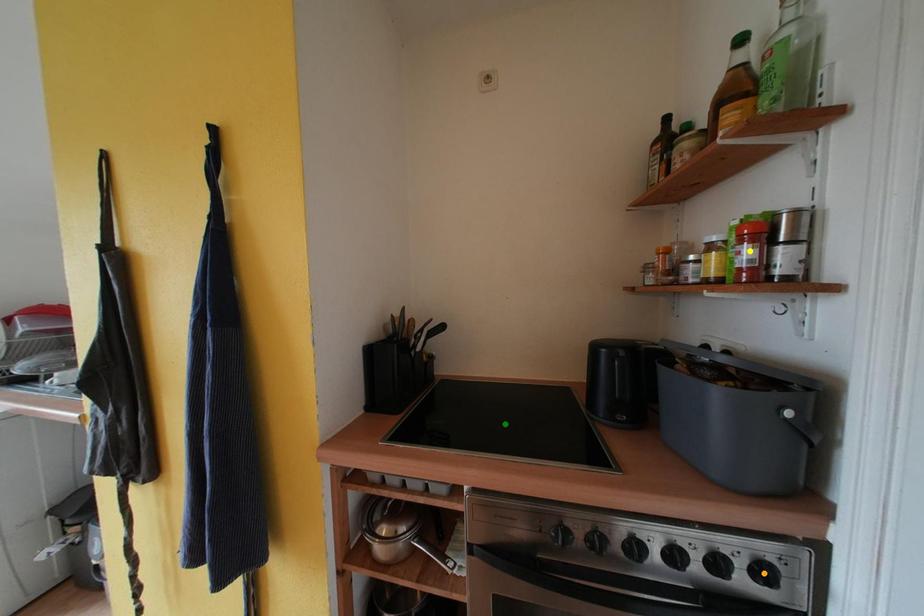
Order these from nearest to farthest:
A) orange point
B) green point
C) yellow point

orange point, yellow point, green point